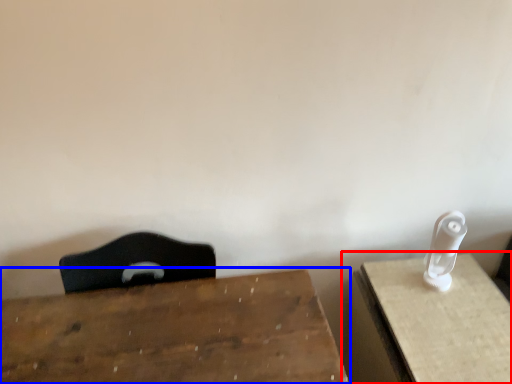
Question: Among these objects, which one is farthest to the camera, table (highlighted by a red box) or table (highlighted by a blue box)?

Choices:
 (A) table
 (B) table

Answer: (A)